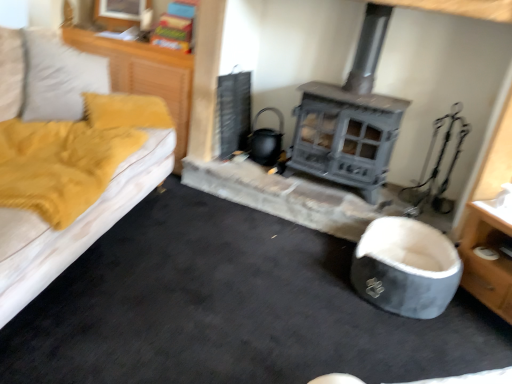
Question: Can you confirm if wooden dresser at lower right, the second dresser in the left-to-right sequence, is bigger than yellow fabric at left, which appears as the second dresser when viewed from the right?

Choices:
 (A) yes
 (B) no

Answer: (A)

Question: Is wooden dresser at lower right, the 1th dresser from the bottom, looking in the opposite direction of yellow fabric at left, which ranks as the 1th dresser in left-to-right order?

Choices:
 (A) no
 (B) yes

Answer: (A)

Question: Does wooden dresser at lower right, the 1th dresser from the bottom, turn towards yellow fabric at left, which appears as the second dresser when ordered from the bottom?

Choices:
 (A) yes
 (B) no

Answer: (B)

Question: Considering the relative sizes of wooden dresser at lower right, which is counted as the 2th dresser, starting from the top, and yellow fabric at left, which appears as the second dresser when ordered from the bottom, in the image provided, is wooden dresser at lower right, which is counted as the 2th dresser, starting from the top, wider than yellow fabric at left, which appears as the second dresser when ordered from the bottom,?

Choices:
 (A) yes
 (B) no

Answer: (A)

Question: Does wooden dresser at lower right, positioned as the first dresser in right-to-left order, have a greater height compared to yellow fabric at left, the 1th dresser positioned from the top?

Choices:
 (A) no
 (B) yes

Answer: (A)

Question: From the image's perspective, would you say wooden dresser at lower right, the 1th dresser from the bottom, is shown under yellow fabric at left, the 1th dresser positioned from the top?

Choices:
 (A) yes
 (B) no

Answer: (A)

Question: Considering the relative sizes of gray fabric bean bag at lower right and wooden dresser at lower right, the 1th dresser from the bottom, in the image provided, is gray fabric bean bag at lower right taller than wooden dresser at lower right, the 1th dresser from the bottom,?

Choices:
 (A) no
 (B) yes

Answer: (A)

Question: From the image's perspective, does gray fabric bean bag at lower right appear lower than wooden dresser at lower right, which is counted as the 2th dresser, starting from the top?

Choices:
 (A) no
 (B) yes

Answer: (B)

Question: Can you confirm if gray fabric bean bag at lower right is smaller than wooden dresser at lower right, the 1th dresser from the bottom?

Choices:
 (A) no
 (B) yes

Answer: (B)

Question: From a real-world perspective, does gray fabric bean bag at lower right stand above wooden dresser at lower right, positioned as the first dresser in right-to-left order?

Choices:
 (A) no
 (B) yes

Answer: (A)

Question: Does gray fabric bean bag at lower right have a greater width compared to wooden dresser at lower right, positioned as the first dresser in right-to-left order?

Choices:
 (A) yes
 (B) no

Answer: (B)

Question: Is gray fabric bean bag at lower right to the left of wooden dresser at lower right, positioned as the first dresser in right-to-left order, from the viewer's perspective?

Choices:
 (A) no
 (B) yes

Answer: (B)

Question: Is gray fabric bean bag at lower right facing away from yellow fabric at left, which appears as the second dresser when viewed from the right?

Choices:
 (A) yes
 (B) no

Answer: (B)